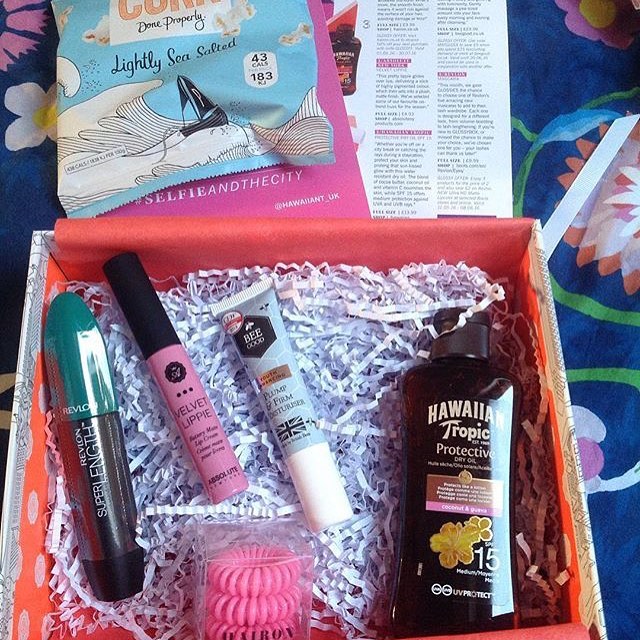
This screenshot has width=640, height=640. I want to click on blanket, so click(564, 70).